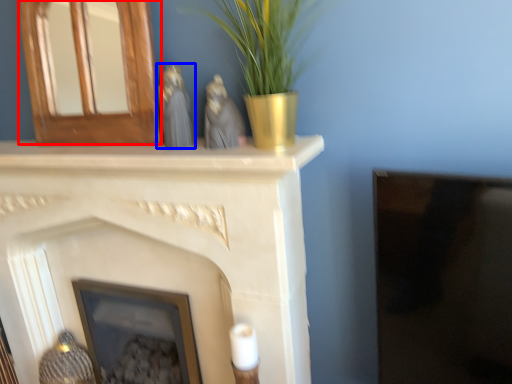
Question: Among these objects, which one is farthest to the camera, fireplace (highlighted by a red box) or animal (highlighted by a blue box)?

Choices:
 (A) fireplace
 (B) animal

Answer: (A)